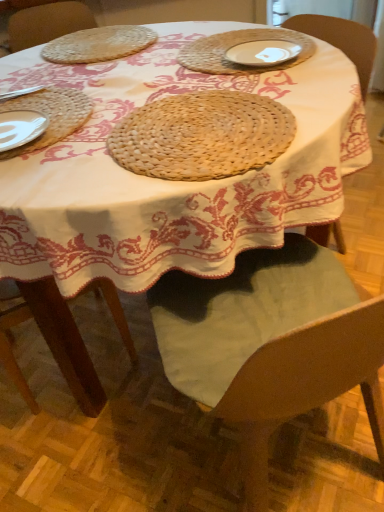
Locate an element on the screen. The width and height of the screenshot is (384, 512). free space between woven straw placemat at left and natural woven placemat at center, placed as the second pie when sorted from top to bottom is located at coordinates (96, 138).